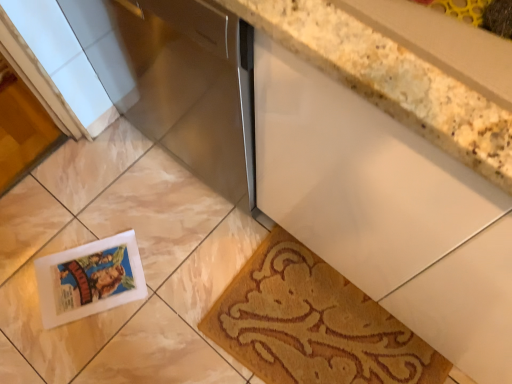
Question: Should I look upward or downward to see white glossy postcard at lower left?

Choices:
 (A) down
 (B) up

Answer: (A)

Question: Does white granite countertop at upper right contain satin silver dishwasher at center?

Choices:
 (A) yes
 (B) no

Answer: (B)

Question: Is white granite countertop at upper right closer to camera compared to satin silver dishwasher at center?

Choices:
 (A) no
 (B) yes

Answer: (B)

Question: Are white granite countertop at upper right and satin silver dishwasher at center located far from each other?

Choices:
 (A) no
 (B) yes

Answer: (A)

Question: From a real-world perspective, is white granite countertop at upper right located beneath satin silver dishwasher at center?

Choices:
 (A) yes
 (B) no

Answer: (B)

Question: Could you tell me if white granite countertop at upper right is turned towards satin silver dishwasher at center?

Choices:
 (A) no
 (B) yes

Answer: (A)

Question: Considering the relative positions of white granite countertop at upper right and satin silver dishwasher at center in the image provided, is white granite countertop at upper right to the right of satin silver dishwasher at center from the viewer's perspective?

Choices:
 (A) yes
 (B) no

Answer: (A)

Question: Considering the relative sizes of satin silver dishwasher at center and white granite countertop at upper right in the image provided, is satin silver dishwasher at center wider than white granite countertop at upper right?

Choices:
 (A) no
 (B) yes

Answer: (B)

Question: Can you confirm if satin silver dishwasher at center is positioned to the left of white granite countertop at upper right?

Choices:
 (A) no
 (B) yes

Answer: (B)

Question: Is satin silver dishwasher at center oriented towards white granite countertop at upper right?

Choices:
 (A) no
 (B) yes

Answer: (A)

Question: Is satin silver dishwasher at center facing away from white granite countertop at upper right?

Choices:
 (A) yes
 (B) no

Answer: (B)

Question: Is satin silver dishwasher at center not close to white granite countertop at upper right?

Choices:
 (A) yes
 (B) no

Answer: (B)

Question: Is satin silver dishwasher at center shorter than white granite countertop at upper right?

Choices:
 (A) no
 (B) yes

Answer: (A)

Question: Does white glossy postcard at lower left have a lesser width compared to white granite countertop at upper right?

Choices:
 (A) no
 (B) yes

Answer: (B)